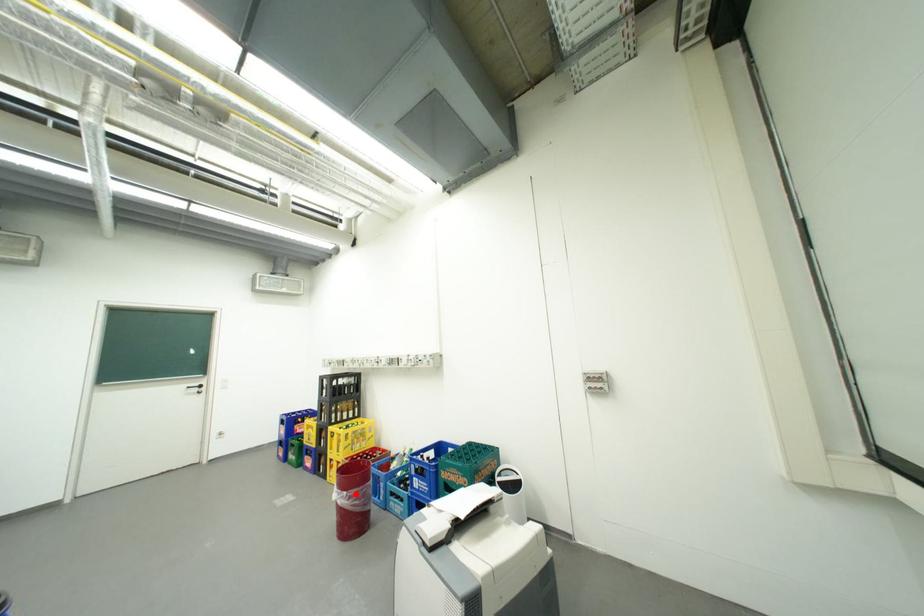
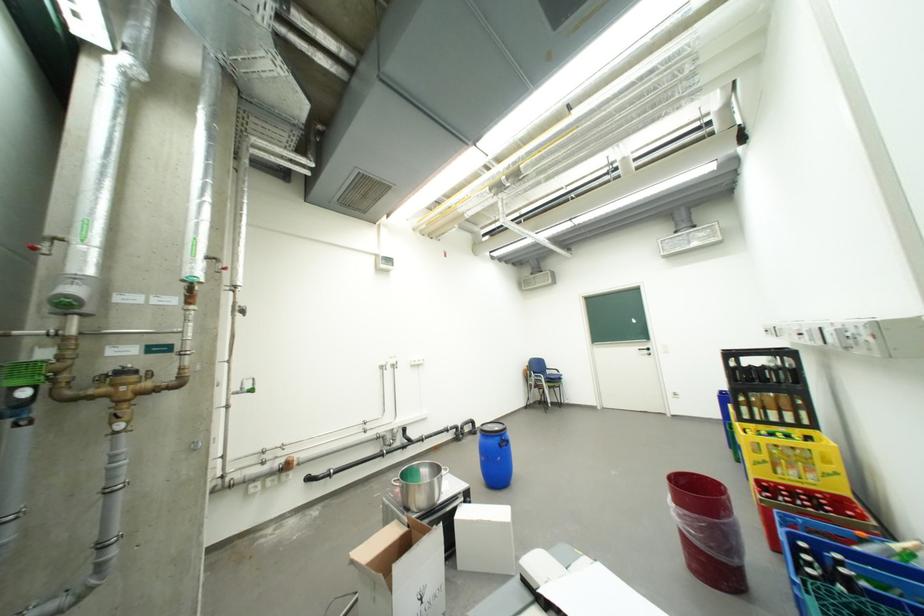
Find the pixel in the second image that matches the highlighted location in the first image.

(685, 507)